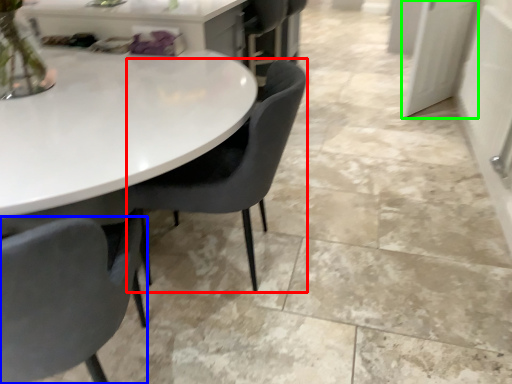
Question: Which is nearer to the chair (highlighted by a red box)? chair (highlighted by a blue box) or glass door (highlighted by a green box).

Choices:
 (A) chair
 (B) glass door

Answer: (A)